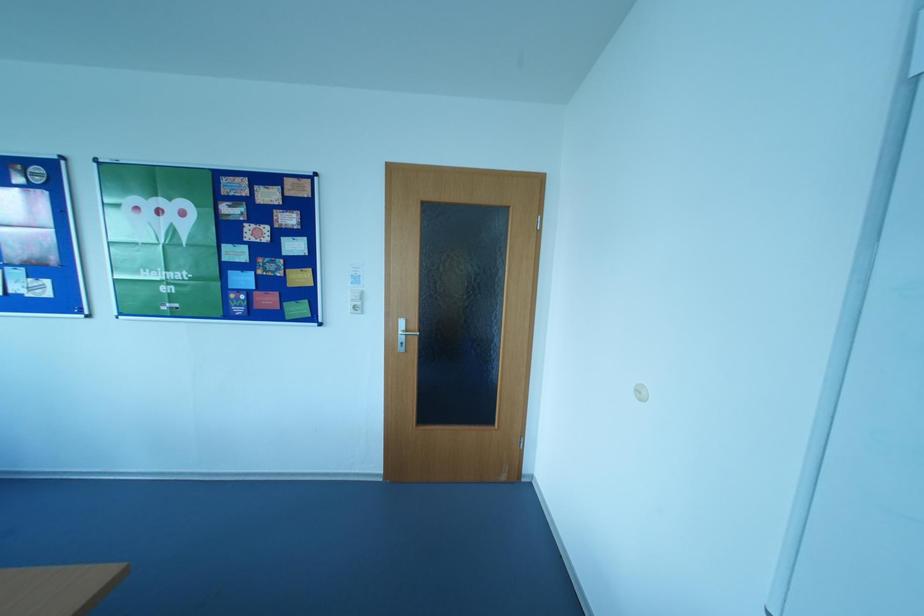
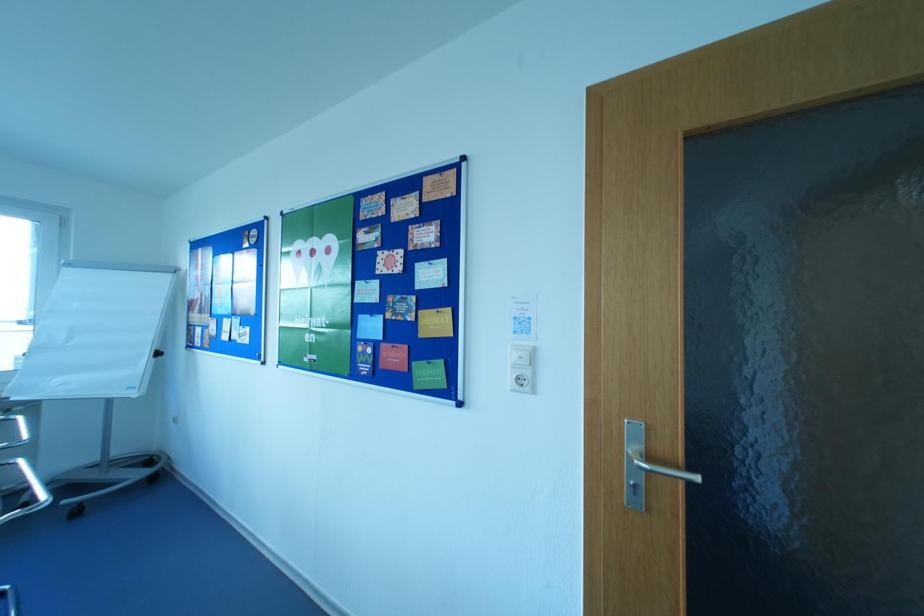
Question: The first image is from the beginning of the video and the second image is from the end. How did the camera likely rotate when shooting the video?

Choices:
 (A) Left
 (B) Right
 (C) Up
 (D) Down

Answer: (A)